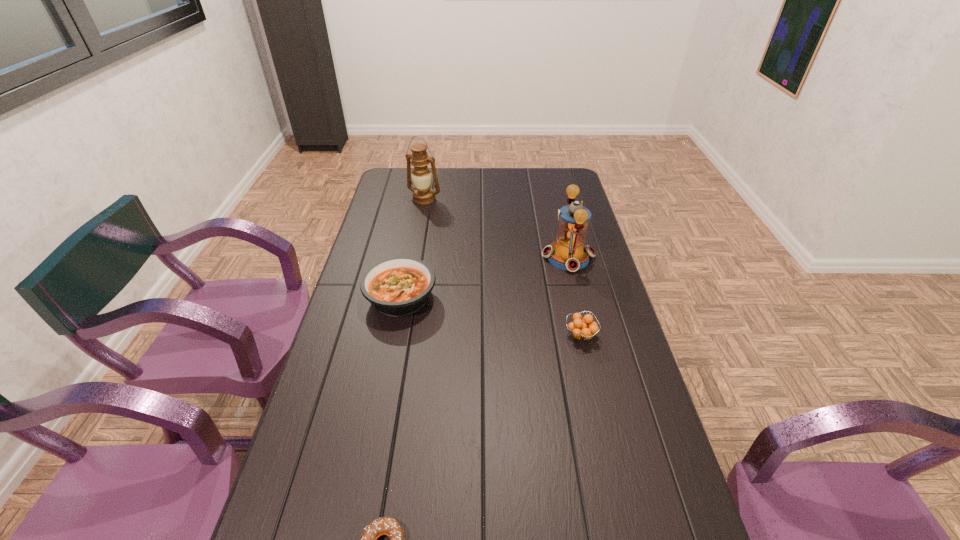
Locate an element on the screen. The height and width of the screenshot is (540, 960). the farthest object is located at coordinates (423, 194).

Find the location of a particular element. lantern is located at coordinates (569, 253).

Find the location of `stew`. stew is located at coordinates (399, 286).

Where is `orange fruit`? orange fruit is located at coordinates (582, 328).

The width and height of the screenshot is (960, 540). Identify the location of free space located on the back of the oil lamp. (427, 184).

This screenshot has width=960, height=540. In order to click on vacant space positioned 0.270m on the front-facing side of the lantern in this screenshot , I will do `click(466, 257)`.

Identify the location of vacant space situated on the front-facing side of the lantern. (435, 257).

Where is `vacant area situated 0.380m on the front-facing side of the lantern`? vacant area situated 0.380m on the front-facing side of the lantern is located at coordinates (435, 257).

Find the location of a particular element. The height and width of the screenshot is (540, 960). vacant space located on the front of the stew is located at coordinates (394, 338).

This screenshot has width=960, height=540. I want to click on vacant point located on the back of the orange fruit, so click(x=566, y=272).